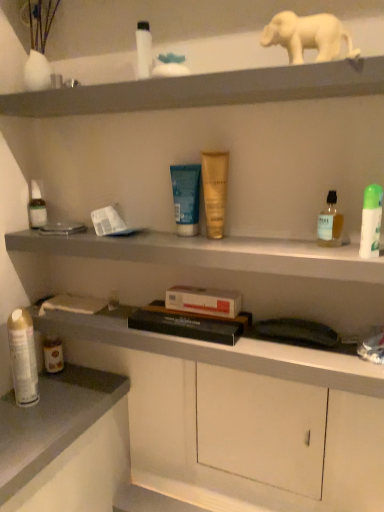
Locate an element on the screen. This screenshot has height=512, width=384. free space between green plastic deodorant at right, arranged as the sixth toiletry when viewed from the left, and translucent plastic bottle at left, the 6th toiletry positioned from the right is located at coordinates (169, 238).